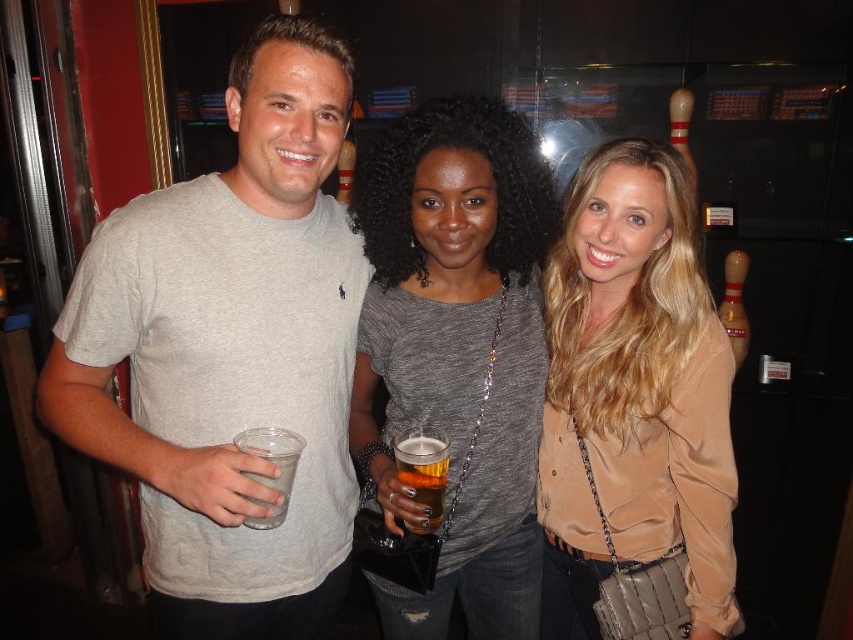
You are a photographer at the event and need to ensure all attendees are visible in the group photo. The matte gray shirt at center and the satin beige blouse at center are both in the frame. Which clothing item has a wider width when viewed from the front?

The matte gray shirt at center has a wider width than the satin beige blouse at center.